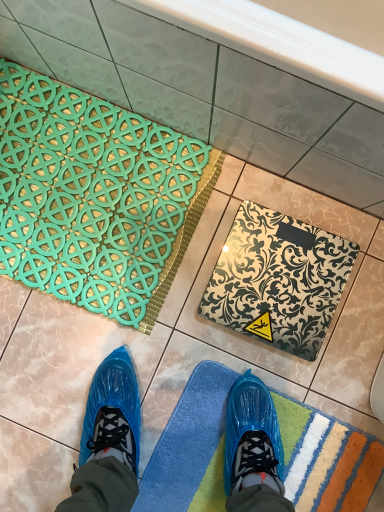
Identify the location of metallic silver scale at center, the 2th bath mat from the bottom. The image size is (384, 512). (278, 280).

Image resolution: width=384 pixels, height=512 pixels. Describe the element at coordinates (191, 448) in the screenshot. I see `blue textured bath mat at lower center, which is the first bath mat from bottom to top` at that location.

What do you see at coordinates (95, 197) in the screenshot? The height and width of the screenshot is (512, 384). I see `teal rubber bath mat at upper left, the 1th bath mat from the top` at bounding box center [95, 197].

At what (x,y) coordinates should I click in order to perform the action: click on metallic silver scale at center, the 2th bath mat from the bottom. Please return your answer as a coordinate pair (x, y). This screenshot has height=512, width=384. Looking at the image, I should click on (278, 280).

Considering the relative sizes of teal rubber bath mat at upper left, which is counted as the 3th bath mat, starting from the bottom, and metallic silver scale at center, the 2th bath mat positioned from the top, in the image provided, is teal rubber bath mat at upper left, which is counted as the 3th bath mat, starting from the bottom, shorter than metallic silver scale at center, the 2th bath mat positioned from the top,?

Yes.

Does teal rubber bath mat at upper left, the 1th bath mat from the top, turn towards metallic silver scale at center, the 2th bath mat from the bottom?

No, teal rubber bath mat at upper left, the 1th bath mat from the top, is not aimed at metallic silver scale at center, the 2th bath mat from the bottom.

Considering their positions, is teal rubber bath mat at upper left, the 1th bath mat from the top, located in front of or behind metallic silver scale at center, the 2th bath mat from the bottom?

teal rubber bath mat at upper left, the 1th bath mat from the top, is behind metallic silver scale at center, the 2th bath mat from the bottom.

Is teal rubber bath mat at upper left, the 1th bath mat from the top, inside or outside of metallic silver scale at center, the 2th bath mat from the bottom?

teal rubber bath mat at upper left, the 1th bath mat from the top, is spatially situated outside metallic silver scale at center, the 2th bath mat from the bottom.

Is point (316, 474) positioned before point (12, 164)?

Yes, it is in front of point (12, 164).

From the image's perspective, which is below, blue textured bath mat at lower center, which is the first bath mat from bottom to top, or teal rubber bath mat at upper left, which is counted as the 3th bath mat, starting from the bottom?

blue textured bath mat at lower center, which is the first bath mat from bottom to top, is shown below in the image.

Is blue textured bath mat at lower center, which is the first bath mat from bottom to top, not near teal rubber bath mat at upper left, the 1th bath mat from the top?

That's not correct — blue textured bath mat at lower center, which is the first bath mat from bottom to top, is a little close to teal rubber bath mat at upper left, the 1th bath mat from the top.

From a real-world perspective, relative to teal rubber bath mat at upper left, the 1th bath mat from the top, is blue textured bath mat at lower center, positioned as the 3th bath mat in top-to-bottom order, vertically above or below?

blue textured bath mat at lower center, positioned as the 3th bath mat in top-to-bottom order, is below teal rubber bath mat at upper left, the 1th bath mat from the top.

Is blue textured bath mat at lower center, positioned as the 3th bath mat in top-to-bottom order, facing away from metallic silver scale at center, the 2th bath mat positioned from the top?

No, blue textured bath mat at lower center, positioned as the 3th bath mat in top-to-bottom order,'s orientation is not away from metallic silver scale at center, the 2th bath mat positioned from the top.

Can metallic silver scale at center, the 2th bath mat from the bottom, be found inside blue textured bath mat at lower center, positioned as the 3th bath mat in top-to-bottom order?

No, metallic silver scale at center, the 2th bath mat from the bottom, is not inside blue textured bath mat at lower center, positioned as the 3th bath mat in top-to-bottom order.

From the image's perspective, is blue textured bath mat at lower center, positioned as the 3th bath mat in top-to-bottom order, located beneath metallic silver scale at center, the 2th bath mat positioned from the top?

Yes.

Is blue textured bath mat at lower center, positioned as the 3th bath mat in top-to-bottom order, positioned far away from metallic silver scale at center, the 2th bath mat from the bottom?

blue textured bath mat at lower center, positioned as the 3th bath mat in top-to-bottom order, is near metallic silver scale at center, the 2th bath mat from the bottom, not far away.

Does metallic silver scale at center, the 2th bath mat from the bottom, have a lesser width compared to teal rubber bath mat at upper left, which is counted as the 3th bath mat, starting from the bottom?

Yes.

In the scene shown: Is metallic silver scale at center, the 2th bath mat positioned from the top, not close to teal rubber bath mat at upper left, the 1th bath mat from the top?

That's not correct — metallic silver scale at center, the 2th bath mat positioned from the top, is a little close to teal rubber bath mat at upper left, the 1th bath mat from the top.

From the image's perspective, which one is positioned lower, metallic silver scale at center, the 2th bath mat from the bottom, or teal rubber bath mat at upper left, the 1th bath mat from the top?

From the image's view, metallic silver scale at center, the 2th bath mat from the bottom, is below.

In terms of size, does metallic silver scale at center, the 2th bath mat from the bottom, appear bigger or smaller than teal rubber bath mat at upper left, the 1th bath mat from the top?

metallic silver scale at center, the 2th bath mat from the bottom, is smaller than teal rubber bath mat at upper left, the 1th bath mat from the top.

At what (x,y) coordinates should I click in order to perform the action: click on the 2nd bath mat positioned below the teal rubber bath mat at upper left, which is counted as the 3th bath mat, starting from the bottom (from the image's perspective). Please return your answer as a coordinate pair (x, y). The image size is (384, 512). Looking at the image, I should click on (191, 448).

Is teal rubber bath mat at upper left, which is counted as the 3th bath mat, starting from the bottom, shorter than blue textured bath mat at lower center, positioned as the 3th bath mat in top-to-bottom order?

Incorrect, the height of teal rubber bath mat at upper left, which is counted as the 3th bath mat, starting from the bottom, does not fall short of that of blue textured bath mat at lower center, positioned as the 3th bath mat in top-to-bottom order.

Is point (64, 257) positioned in front of point (198, 390)?

That is False.

Considering the sizes of objects metallic silver scale at center, the 2th bath mat positioned from the top, and blue textured bath mat at lower center, which is the first bath mat from bottom to top, in the image provided, who is bigger, metallic silver scale at center, the 2th bath mat positioned from the top, or blue textured bath mat at lower center, which is the first bath mat from bottom to top,?

metallic silver scale at center, the 2th bath mat positioned from the top, is bigger.

Is metallic silver scale at center, the 2th bath mat from the bottom, outside of blue textured bath mat at lower center, which is the first bath mat from bottom to top?

Yes, metallic silver scale at center, the 2th bath mat from the bottom, is outside of blue textured bath mat at lower center, which is the first bath mat from bottom to top.

At what (x,y) coordinates should I click in order to perform the action: click on bath mat on the right of blue textured bath mat at lower center, positioned as the 3th bath mat in top-to-bottom order. Please return your answer as a coordinate pair (x, y). Looking at the image, I should click on (278, 280).

Which bath mat is the 2nd one when counting from the left side of the metallic silver scale at center, the 2th bath mat from the bottom? Please provide its 2D coordinates.

[(95, 197)]

This screenshot has height=512, width=384. Identify the location of bath mat that is the 2nd one when counting backward from the blue textured bath mat at lower center, positioned as the 3th bath mat in top-to-bottom order. (95, 197).

When comparing their distances from metallic silver scale at center, the 2th bath mat from the bottom, does teal rubber bath mat at upper left, the 1th bath mat from the top, or blue textured bath mat at lower center, positioned as the 3th bath mat in top-to-bottom order, seem closer?

Among the two, blue textured bath mat at lower center, positioned as the 3th bath mat in top-to-bottom order, is located nearer to metallic silver scale at center, the 2th bath mat from the bottom.

From the image, which object appears to be farther from metallic silver scale at center, the 2th bath mat positioned from the top, blue textured bath mat at lower center, positioned as the 3th bath mat in top-to-bottom order, or teal rubber bath mat at upper left, the 1th bath mat from the top?

The object further to metallic silver scale at center, the 2th bath mat positioned from the top, is teal rubber bath mat at upper left, the 1th bath mat from the top.

When comparing their distances from teal rubber bath mat at upper left, the 1th bath mat from the top, does blue textured bath mat at lower center, positioned as the 3th bath mat in top-to-bottom order, or metallic silver scale at center, the 2th bath mat positioned from the top, seem further?

Based on the image, blue textured bath mat at lower center, positioned as the 3th bath mat in top-to-bottom order, appears to be further to teal rubber bath mat at upper left, the 1th bath mat from the top.

From the image, which object appears to be nearer to teal rubber bath mat at upper left, which is counted as the 3th bath mat, starting from the bottom, metallic silver scale at center, the 2th bath mat from the bottom, or blue textured bath mat at lower center, which is the first bath mat from bottom to top?

metallic silver scale at center, the 2th bath mat from the bottom, is positioned closer to the anchor teal rubber bath mat at upper left, which is counted as the 3th bath mat, starting from the bottom.

From the image, which object appears to be farther from blue textured bath mat at lower center, which is the first bath mat from bottom to top, teal rubber bath mat at upper left, which is counted as the 3th bath mat, starting from the bottom, or metallic silver scale at center, the 2th bath mat from the bottom?

teal rubber bath mat at upper left, which is counted as the 3th bath mat, starting from the bottom, is further to blue textured bath mat at lower center, which is the first bath mat from bottom to top.

Looking at the image, which one is located closer to blue textured bath mat at lower center, which is the first bath mat from bottom to top, metallic silver scale at center, the 2th bath mat positioned from the top, or teal rubber bath mat at upper left, the 1th bath mat from the top?

Among the two, metallic silver scale at center, the 2th bath mat positioned from the top, is located nearer to blue textured bath mat at lower center, which is the first bath mat from bottom to top.

Identify the location of bath mat between teal rubber bath mat at upper left, the 1th bath mat from the top, and blue textured bath mat at lower center, which is the first bath mat from bottom to top, in the vertical direction. (278, 280).